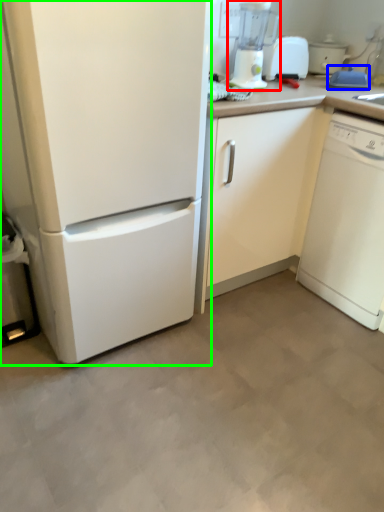
Question: Which object is positioned closest to blender (highlighted by a red box)? Select from appliance (highlighted by a blue box) and home appliance (highlighted by a green box).

Choices:
 (A) appliance
 (B) home appliance

Answer: (A)